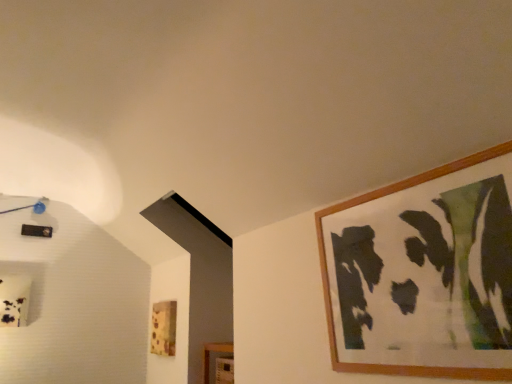
Question: Which direction should I rotate to face wooden picture frame at lower center, which ranks as the second picture frame in top-to-bottom order, — up or down?

Choices:
 (A) down
 (B) up

Answer: (A)

Question: Can you confirm if wooden picture frame at upper right, the second picture frame when ordered from bottom to top, is wider than wooden picture frame at lower center, which is counted as the first picture frame, starting from the bottom?

Choices:
 (A) no
 (B) yes

Answer: (B)

Question: Is wooden picture frame at upper right, positioned as the 1th picture frame in front-to-back order, taller than wooden picture frame at lower center, which is counted as the first picture frame, starting from the bottom?

Choices:
 (A) yes
 (B) no

Answer: (A)

Question: Is wooden picture frame at upper right, which ranks as the second picture frame in back-to-front order, positioned with its back to wooden picture frame at lower center, which appears as the first picture frame when viewed from the back?

Choices:
 (A) yes
 (B) no

Answer: (B)

Question: From the image's perspective, is wooden picture frame at upper right, the second picture frame when ordered from bottom to top, located beneath wooden picture frame at lower center, which is counted as the first picture frame, starting from the bottom?

Choices:
 (A) yes
 (B) no

Answer: (B)

Question: Is wooden picture frame at upper right, positioned as the 1th picture frame in front-to-back order, closer to the viewer compared to wooden picture frame at lower center, which appears as the first picture frame when viewed from the back?

Choices:
 (A) yes
 (B) no

Answer: (A)

Question: Is wooden picture frame at upper right, positioned as the 1th picture frame in front-to-back order, to the right of wooden picture frame at lower center, which is counted as the first picture frame, starting from the bottom, from the viewer's perspective?

Choices:
 (A) no
 (B) yes

Answer: (B)

Question: Can you confirm if wooden picture frame at lower center, the 2th picture frame when ordered from front to back, is smaller than wooden picture frame at upper right, the second picture frame when ordered from bottom to top?

Choices:
 (A) no
 (B) yes

Answer: (B)

Question: Does wooden picture frame at lower center, which appears as the second picture frame when viewed from the right, have a larger size compared to wooden picture frame at upper right, the 1th picture frame viewed from the right?

Choices:
 (A) no
 (B) yes

Answer: (A)

Question: From a real-world perspective, is wooden picture frame at lower center, which ranks as the second picture frame in top-to-bottom order, on wooden picture frame at upper right, the second picture frame when ordered from bottom to top?

Choices:
 (A) no
 (B) yes

Answer: (A)

Question: Can you confirm if wooden picture frame at lower center, the 2th picture frame when ordered from front to back, is positioned to the left of wooden picture frame at upper right, the second picture frame when ordered from bottom to top?

Choices:
 (A) no
 (B) yes

Answer: (B)

Question: From the image's perspective, is wooden picture frame at lower center, which appears as the second picture frame when viewed from the right, on top of wooden picture frame at upper right, arranged as the 1th picture frame when viewed from the top?

Choices:
 (A) yes
 (B) no

Answer: (B)

Question: Is wooden picture frame at lower center, which appears as the first picture frame when viewed from the back, located outside wooden picture frame at upper right, the 2th picture frame in the left-to-right sequence?

Choices:
 (A) no
 (B) yes

Answer: (B)

Question: Is wooden picture frame at upper right, the second picture frame when ordered from bottom to top, in front of or behind wooden picture frame at lower center, the 2th picture frame when ordered from front to back, in the image?

Choices:
 (A) behind
 (B) front

Answer: (B)